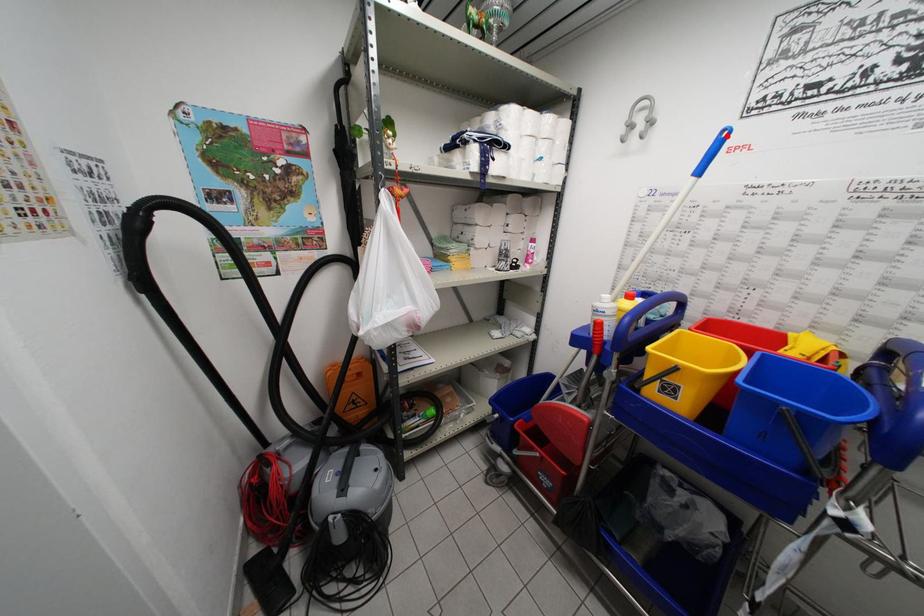
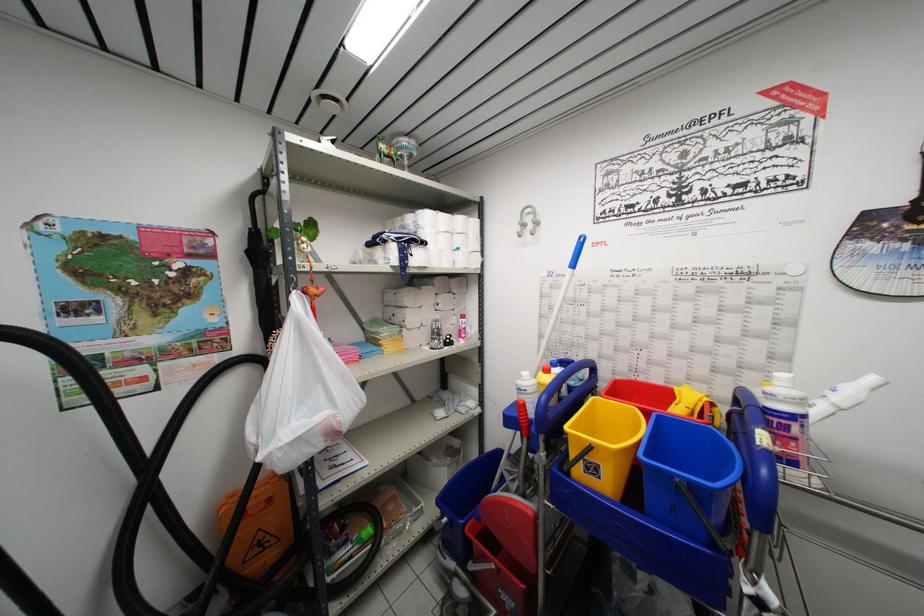
In the second image, find the point that corresponds to the highlighted location in the first image.

(584, 241)